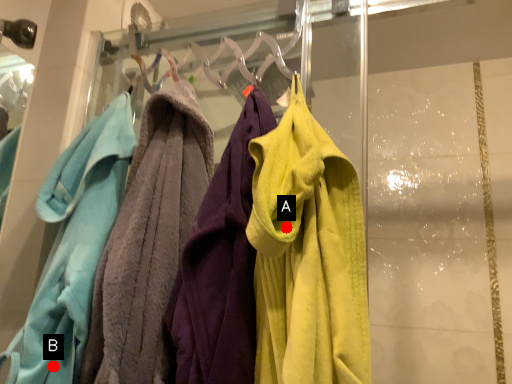
Question: Two points are circled on the image, labeled by A and B beside each circle. Which point is closer to the camera?

Choices:
 (A) A is closer
 (B) B is closer

Answer: (A)